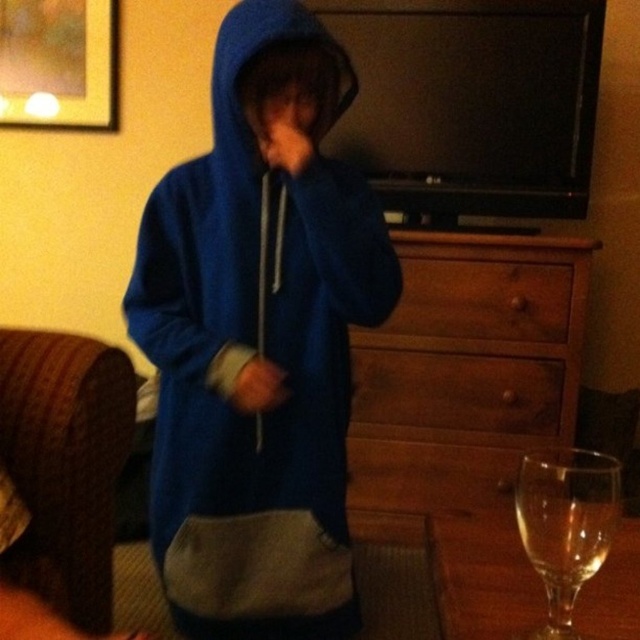
Is wooden dresser at center wider than brushed metal picture frame at upper left?

Indeed, wooden dresser at center has a greater width compared to brushed metal picture frame at upper left.

Based on the photo, who is lower down, wooden dresser at center or brushed metal picture frame at upper left?

wooden dresser at center is lower down.

This screenshot has height=640, width=640. Describe the element at coordinates (470, 364) in the screenshot. I see `wooden dresser at center` at that location.

The width and height of the screenshot is (640, 640). I want to click on wooden dresser at center, so click(470, 364).

Who is higher up, brushed metal picture frame at upper left or brown wood drawer at center?

Positioned higher is brushed metal picture frame at upper left.

Is brushed metal picture frame at upper left above brown wood drawer at center?

Correct, brushed metal picture frame at upper left is located above brown wood drawer at center.

I want to click on brushed metal picture frame at upper left, so click(x=58, y=61).

Image resolution: width=640 pixels, height=640 pixels. I want to click on brushed metal picture frame at upper left, so click(58, 61).

Measure the distance between blue fleece hoodie at center and brown wood drawer at center.

blue fleece hoodie at center and brown wood drawer at center are 33.14 inches apart.

Is blue fleece hoodie at center taller than brown wood drawer at center?

Yes.

Is point (224, 486) positioned in front of point (481, 272)?

Yes, it is in front of point (481, 272).

Find the location of `blue fleece hoodie at center`. blue fleece hoodie at center is located at coordinates (259, 339).